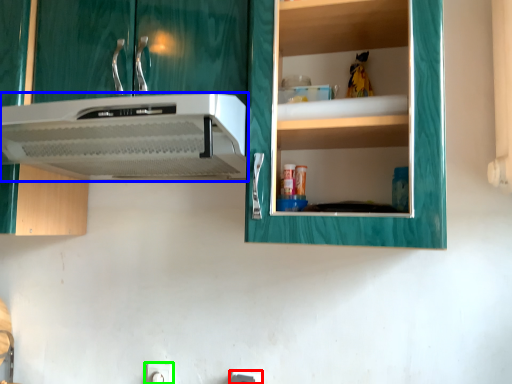
Question: Which object is the closest to the electric outlet (highlighted by a red box)? Choose among these: home appliance (highlighted by a blue box) or electric outlet (highlighted by a green box).

Choices:
 (A) home appliance
 (B) electric outlet

Answer: (B)